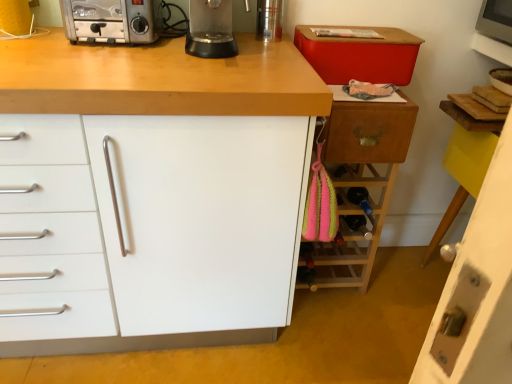
Where is `free location to the right of wooden wine rack at right, arranged as the 2th cabinetry when viewed from the left`? free location to the right of wooden wine rack at right, arranged as the 2th cabinetry when viewed from the left is located at coordinates (x=395, y=278).